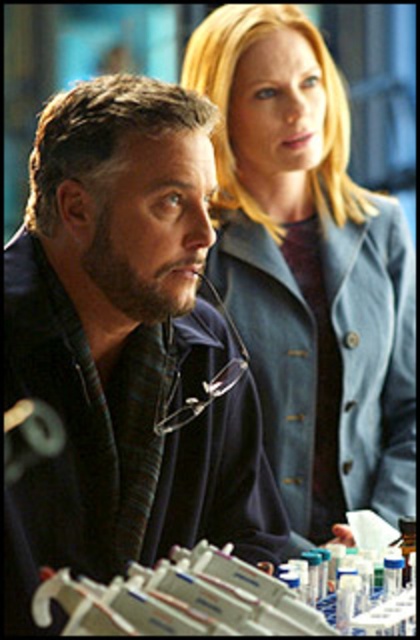
Question: Does dark blue textured jacket at center come in front of denim jacket at upper right?

Choices:
 (A) yes
 (B) no

Answer: (A)

Question: Can you confirm if dark blue textured jacket at center is positioned to the right of denim jacket at upper right?

Choices:
 (A) yes
 (B) no

Answer: (B)

Question: Can you confirm if dark blue textured jacket at center is positioned to the left of denim jacket at upper right?

Choices:
 (A) yes
 (B) no

Answer: (A)